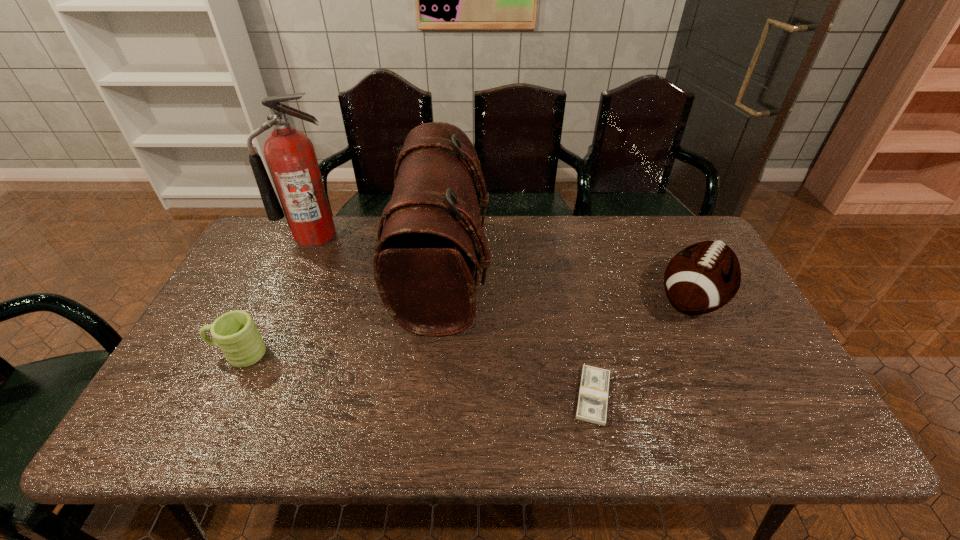
This screenshot has width=960, height=540. Identify the location of fire extinguisher. (290, 155).

This screenshot has width=960, height=540. In order to click on the third object from left to right in this screenshot , I will do `click(424, 264)`.

Identify the location of satchel. (424, 264).

Where is `the rightmost object`? The width and height of the screenshot is (960, 540). the rightmost object is located at coordinates (703, 277).

Find the location of `football (American)`. football (American) is located at coordinates (703, 277).

Where is `mug`? The image size is (960, 540). mug is located at coordinates (235, 333).

Where is `dollar`? Image resolution: width=960 pixels, height=540 pixels. dollar is located at coordinates (593, 394).

The image size is (960, 540). In order to click on the shortest object in this screenshot , I will do `click(593, 394)`.

The image size is (960, 540). What are the coordinates of `free region located on the front of the fire extinguisher near the operation label` in the screenshot? It's located at pos(298,273).

This screenshot has height=540, width=960. What are the coordinates of `free point located 0.150m on the front-facing side of the third object from right to left` in the screenshot? It's located at [x=538, y=271].